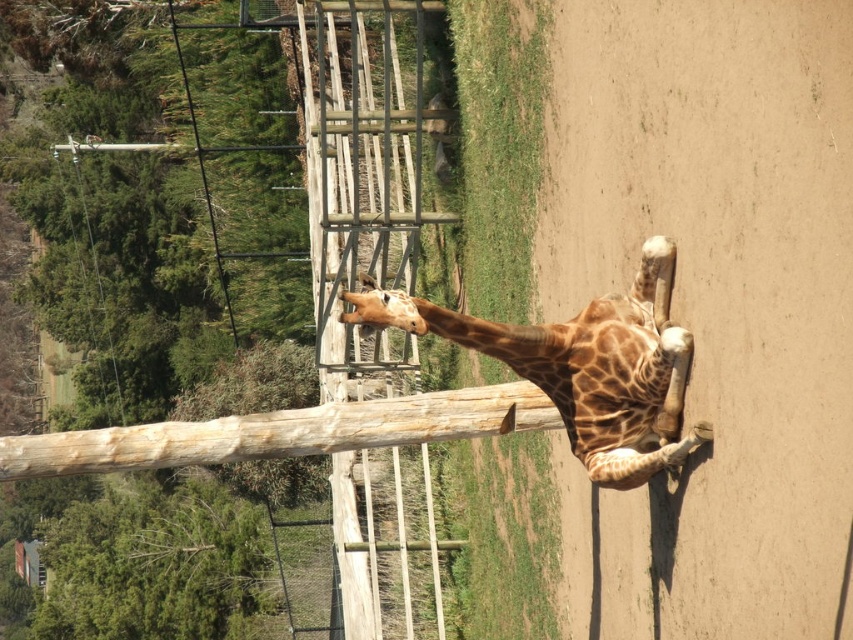
Is spotted fur giraffe at center positioned before spotted fur giraffe head at center?

Yes.

Consider the image. Does spotted fur giraffe at center appear under spotted fur giraffe head at center?

Indeed, spotted fur giraffe at center is positioned under spotted fur giraffe head at center.

Between point (573, 392) and point (375, 282), which one is positioned in front?

Point (375, 282) is more forward.

The image size is (853, 640). I want to click on spotted fur giraffe at center, so click(x=583, y=365).